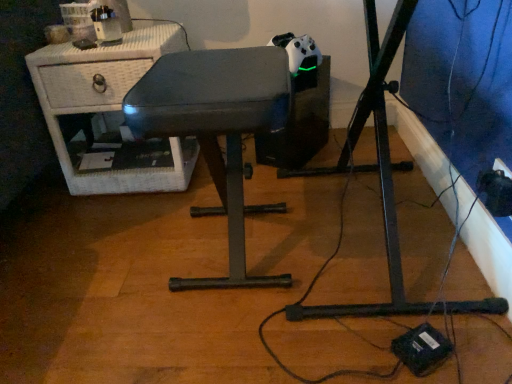
You are a GUI agent. You are given a task and a screenshot of the screen. Output one action in this format:
    pyautogui.click(x=<x>, y=<y>)
    Task: Click on the vacant space in front of white wicker nightstand at upper left, the second furniture when ordered from front to back
    The height and width of the screenshot is (384, 512).
    Given the screenshot: What is the action you would take?
    pyautogui.click(x=100, y=228)